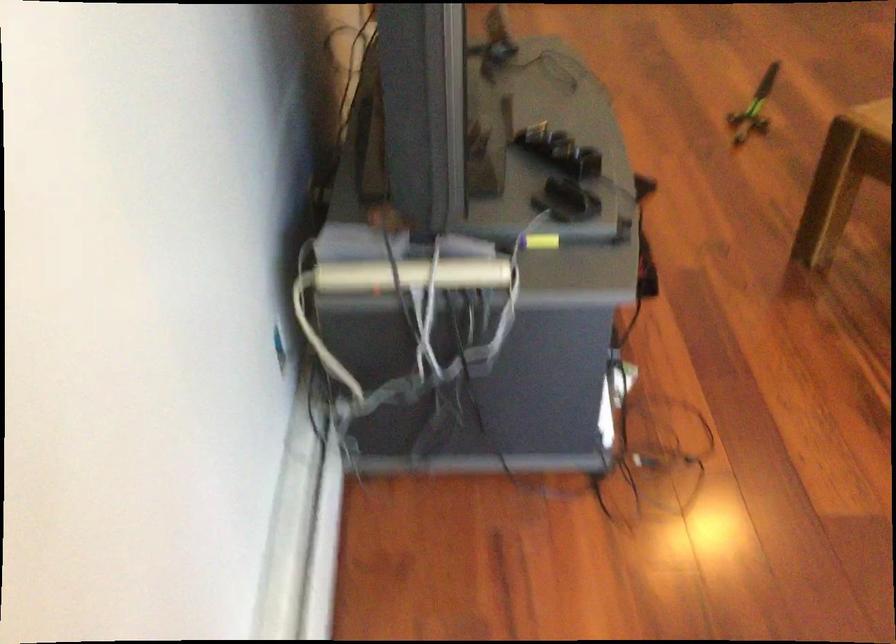
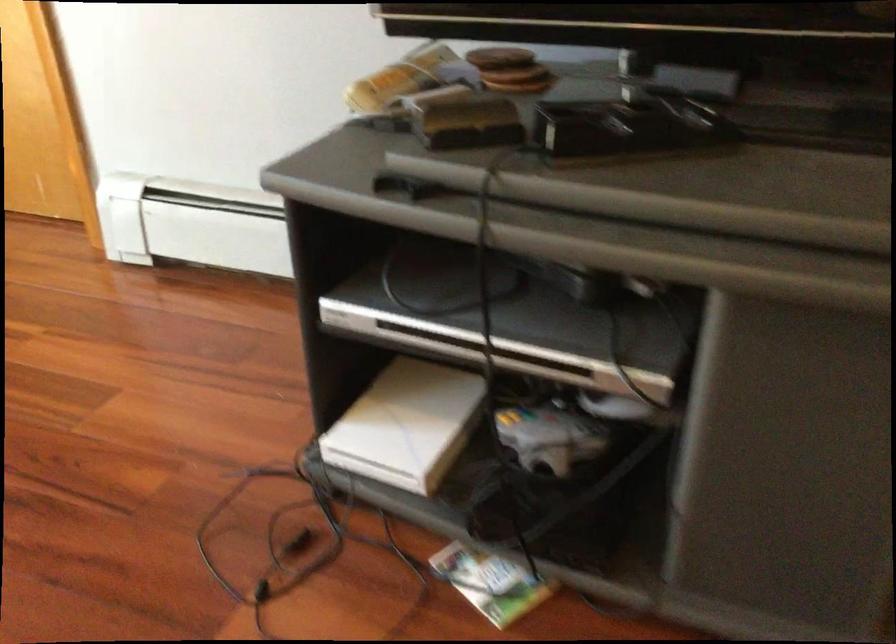
Locate, in the second image, the point that corresponds to point 441,202 in the first image.

(519, 80)